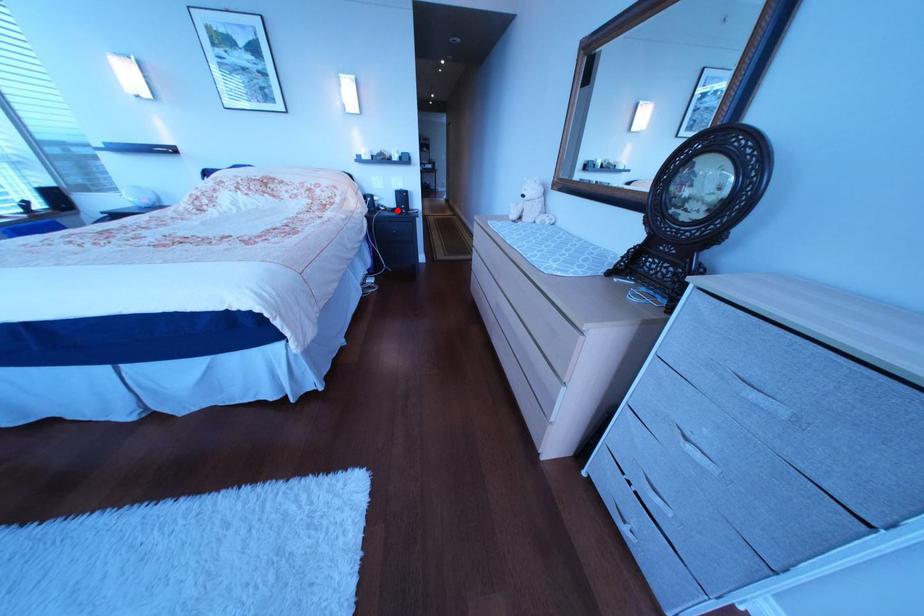
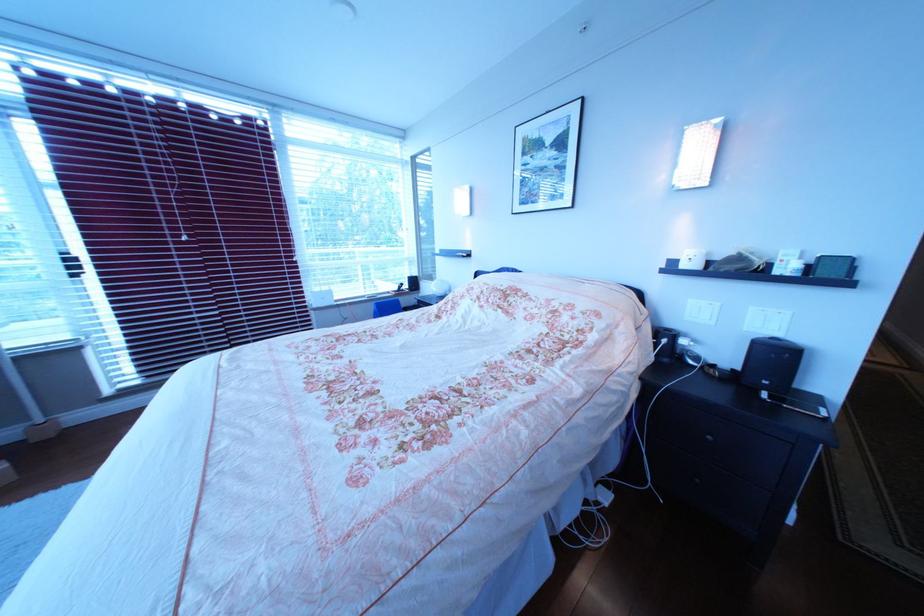
Where in the second image is the point corresponding to the highlighted location from the first image?

(707, 363)